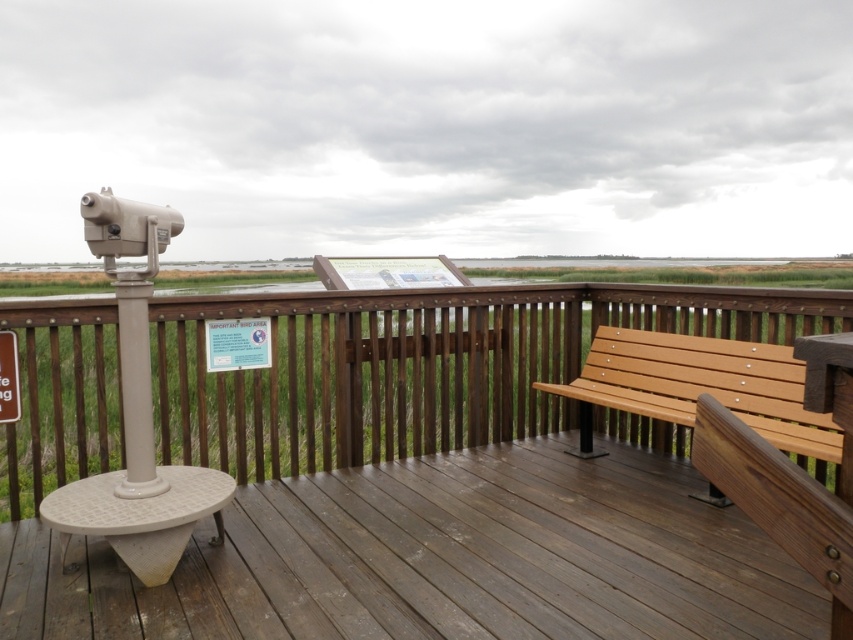
From the picture: You are a visitor at the observation deck and want to sit down. You see two wooden benches available. The wooden bench at center and the wooden bench at right. Which bench is taller?

The wooden bench at center is much taller than the wooden bench at right.

You are a visitor at the observation deck and want to sit on the wooden bench at right. Which direction should you move from the wooden bench at center to reach it?

You should move to the right from the wooden bench at center to reach the wooden bench at right since the wooden bench at center is to the left of wooden bench at right.